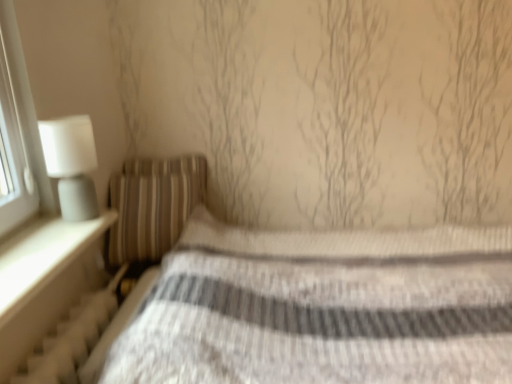
Question: From a real-world perspective, relative to striped fabric pillow at left, is white textured radiator at lower left vertically above or below?

Choices:
 (A) below
 (B) above

Answer: (A)

Question: In the image, is white textured radiator at lower left on the left side or the right side of striped fabric pillow at left?

Choices:
 (A) right
 (B) left

Answer: (B)

Question: Which of these objects is positioned closest to the white matte table lamp at left?

Choices:
 (A) white textured radiator at lower left
 (B) striped fabric bed at center
 (C) striped fabric pillow at left

Answer: (A)

Question: Based on their relative distances, which object is farther from the striped fabric pillow at left?

Choices:
 (A) striped fabric bed at center
 (B) white matte table lamp at left
 (C) white textured radiator at lower left

Answer: (B)